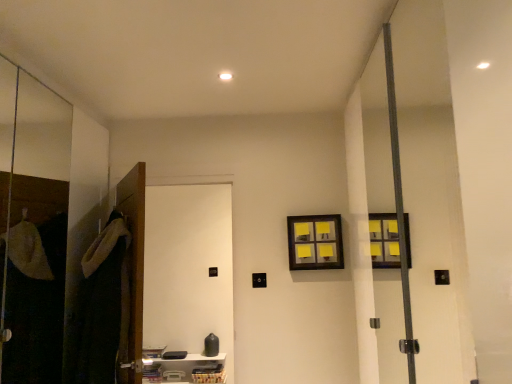
Question: From a real-world perspective, relative to wooden door at left, is dark green fabric robe at left vertically above or below?

Choices:
 (A) below
 (B) above

Answer: (A)

Question: Looking at their shapes, would you say dark green fabric robe at left is wider or thinner than wooden door at left?

Choices:
 (A) wide
 (B) thin

Answer: (A)

Question: Estimate the real-world distances between objects in this image. Which object is farther from the transparent glass screen door at left, the second screen door viewed from the right?

Choices:
 (A) wooden door at left
 (B) white matte door at left, marked as the 1th screen door in a right-to-left arrangement
 (C) yellow sticky notes at upper center
 (D) dark green fabric robe at left
 (E) white plastic shelf at lower center

Answer: (B)

Question: Considering the real-world distances, which object is closest to the wooden door at left?

Choices:
 (A) dark green fabric robe at left
 (B) white plastic shelf at lower center
 (C) yellow sticky notes at upper center
 (D) white matte door at left, which is the 2th screen door in left-to-right order
 (E) transparent glass screen door at left, the second screen door viewed from the right

Answer: (A)